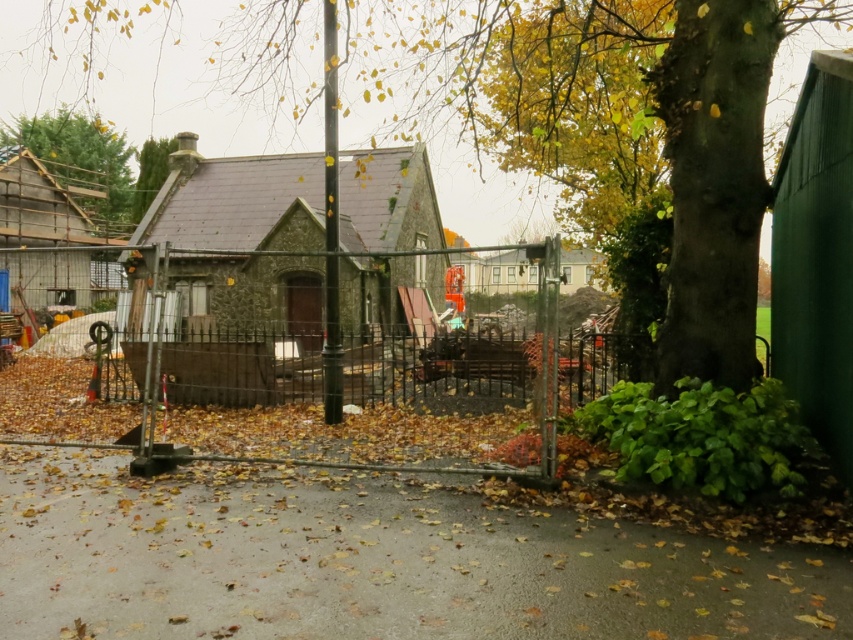
Question: Which point appears farthest from the camera in this image?

Choices:
 (A) (100, 152)
 (B) (509, 8)

Answer: (A)

Question: Does green rough bark tree at center appear on the left side of green textured wood at upper left?

Choices:
 (A) no
 (B) yes

Answer: (A)

Question: Is green rough bark tree at center behind green textured wood at upper left?

Choices:
 (A) yes
 (B) no

Answer: (B)

Question: Which point appears closest to the camera in this image?

Choices:
 (A) (7, 141)
 (B) (49, 1)

Answer: (A)

Question: Can you confirm if green rough bark tree at center is smaller than green textured wood at upper left?

Choices:
 (A) no
 (B) yes

Answer: (A)

Question: Among these points, which one is farthest from the camera?

Choices:
 (A) (65, 148)
 (B) (15, 44)

Answer: (B)